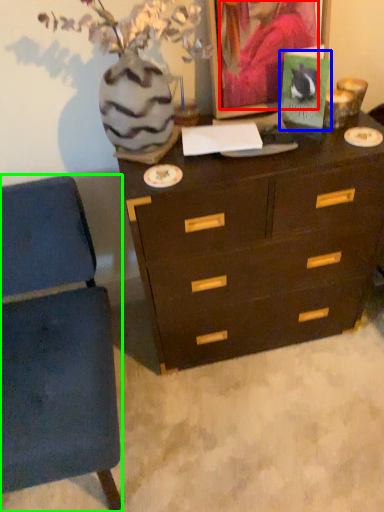
Question: Which object is the closest to the person (highlighted by a red box)? Choose among these: postcard (highlighted by a blue box) or furniture (highlighted by a green box).

Choices:
 (A) postcard
 (B) furniture

Answer: (A)